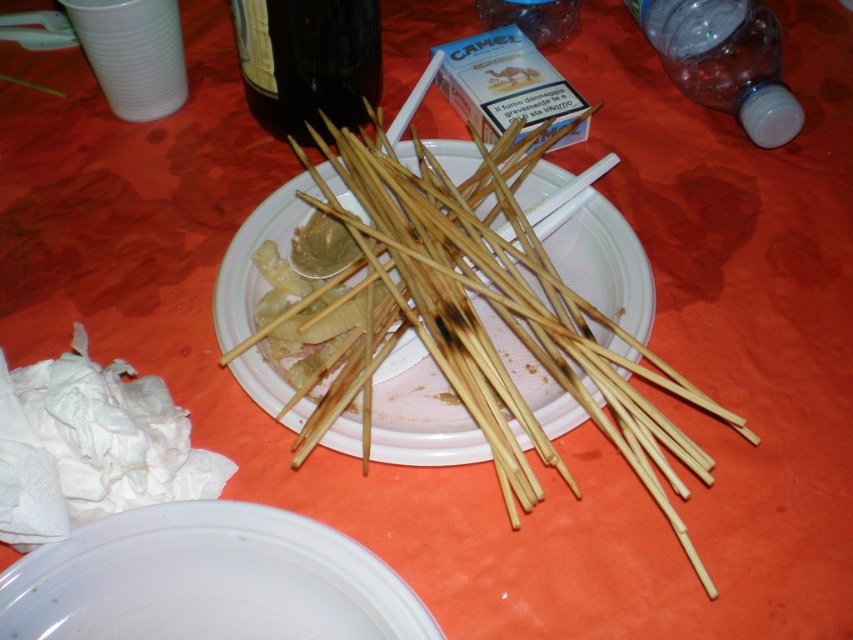
Question: Does bamboo skewers at center come behind wooden skewers at center?

Choices:
 (A) yes
 (B) no

Answer: (B)

Question: Is white plastic plate at lower left positioned behind transparent plastic bottle at upper center?

Choices:
 (A) yes
 (B) no

Answer: (B)

Question: Which point is closer to the camera?

Choices:
 (A) (415, 308)
 (B) (262, 67)
 (C) (560, 6)

Answer: (A)

Question: Which of the following is the closest to the observer?

Choices:
 (A) wooden skewers at center
 (B) bamboo skewers at center

Answer: (B)

Question: Is transparent plastic bottle at upper right wider than transparent plastic bottle at upper center?

Choices:
 (A) no
 (B) yes

Answer: (B)

Question: Which point appears closest to the camera in this image?

Choices:
 (A) (415, 452)
 (B) (544, 1)

Answer: (A)